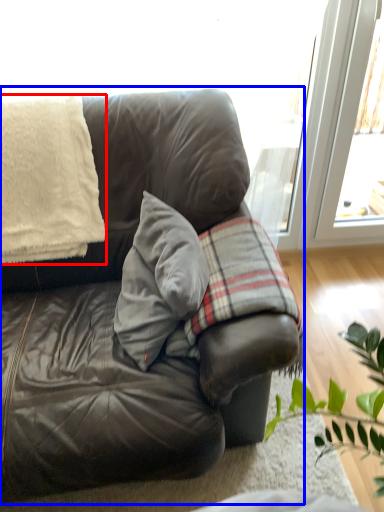
Question: Which object is further to the camera taking this photo, blanket (highlighted by a red box) or studio couch (highlighted by a blue box)?

Choices:
 (A) blanket
 (B) studio couch

Answer: (A)